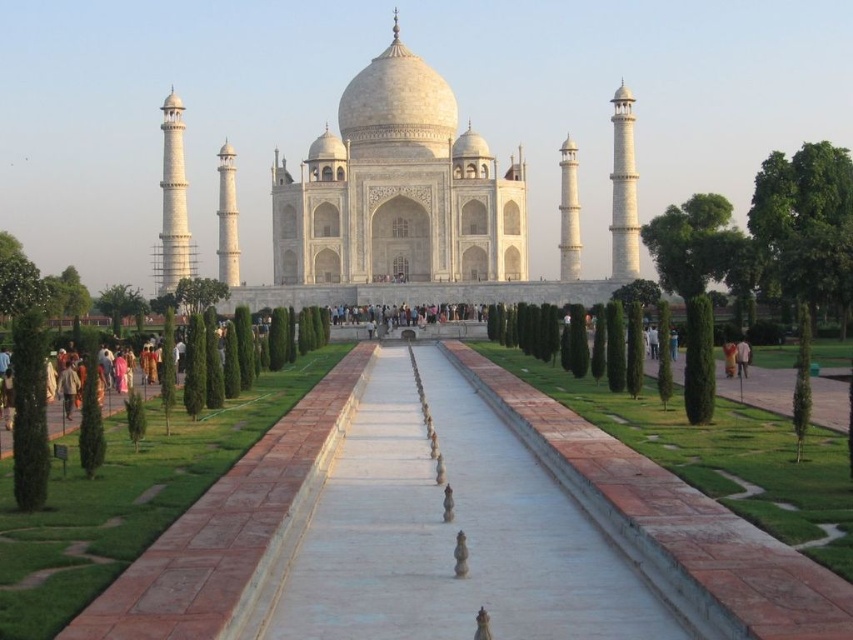
Question: Among these objects, which one is nearest to the camera?

Choices:
 (A) yellow cotton shirt at center
 (B) dark brown wooden bench at center
 (C) orange sari at center

Answer: (C)

Question: Does white marble taj mahal at center appear over yellow cotton shirt at center?

Choices:
 (A) yes
 (B) no

Answer: (A)

Question: Which of the following is the closest to the observer?

Choices:
 (A) white marble taj mahal at center
 (B) dark brown wooden bench at center
 (C) dark blue fabric at center

Answer: (C)

Question: Which of the following is the farthest from the observer?

Choices:
 (A) dark brown wooden bench at center
 (B) yellow cotton shirt at center

Answer: (A)

Question: Does smooth stone pathway at center have a lesser width compared to dark brown wooden bench at center?

Choices:
 (A) yes
 (B) no

Answer: (B)

Question: Considering the relative positions of orange sari at center and dark blue fabric at center in the image provided, where is orange sari at center located with respect to dark blue fabric at center?

Choices:
 (A) below
 (B) above

Answer: (A)